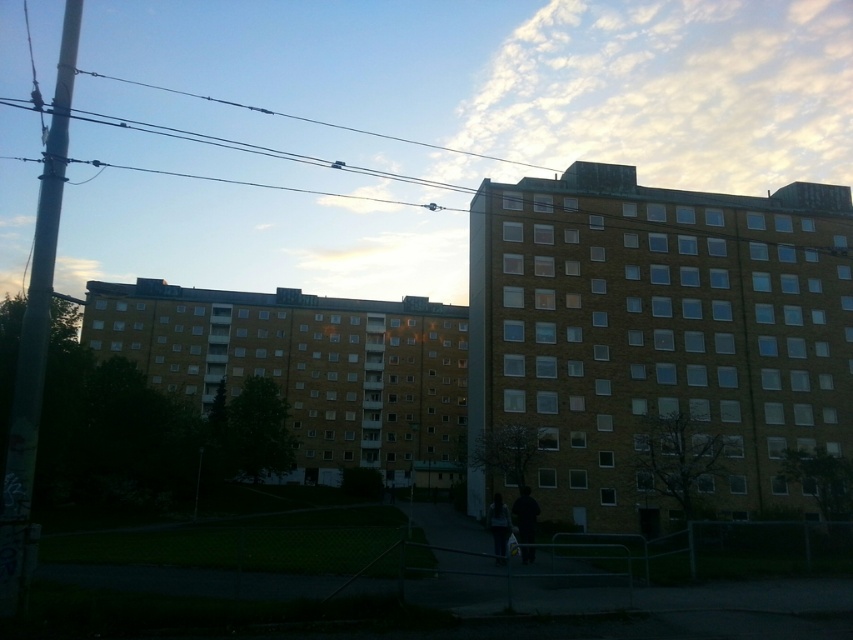
Locate an element on the screen. dark gray fabric jacket at lower center is located at coordinates [x=525, y=522].

Who is lower down, dark gray fabric jacket at lower center or dark blue jeans at lower center?

dark blue jeans at lower center is lower down.

Who is more distant from viewer, (x=537, y=506) or (x=495, y=525)?

Positioned behind is point (x=537, y=506).

You are a GUI agent. You are given a task and a screenshot of the screen. Output one action in this format:
    pyautogui.click(x=<x>, y=<y>)
    Task: Click on the dark gray fabric jacket at lower center
    The width and height of the screenshot is (853, 640).
    Given the screenshot: What is the action you would take?
    pyautogui.click(x=525, y=522)